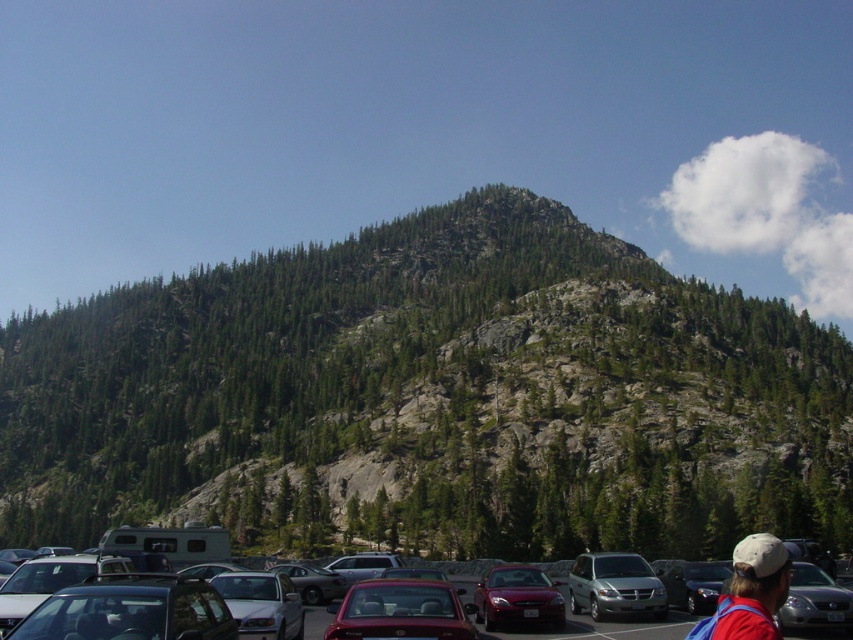
You are standing at the base of the mountain and want to take a photo of the metallic silver sedan at lower left. Which direction should you face to capture the entire mountain and the sedan in the frame?

To capture the entire mountain and the metallic silver sedan at lower left in the frame, you should face towards the lower left direction where the metallic silver sedan is located.

From the picture: You are standing at the base of the mountain and see the metallic silver cars at lower center and the red shirt at lower right. Which object is higher up the mountain?

The metallic silver cars at lower center are higher up the mountain than the red shirt at lower right because the metallic silver cars at lower center is above red shirt at lower right.